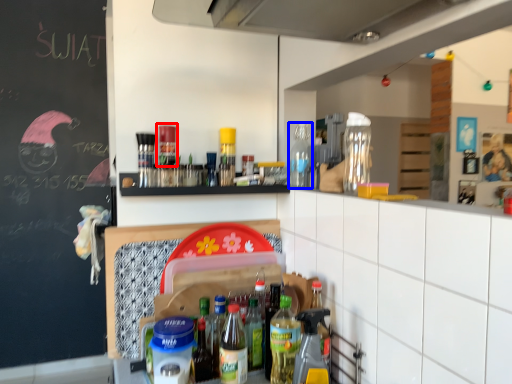
Question: Among these objects, which one is farthest to the camera, bottle (highlighted by a red box) or bottle (highlighted by a blue box)?

Choices:
 (A) bottle
 (B) bottle

Answer: (B)